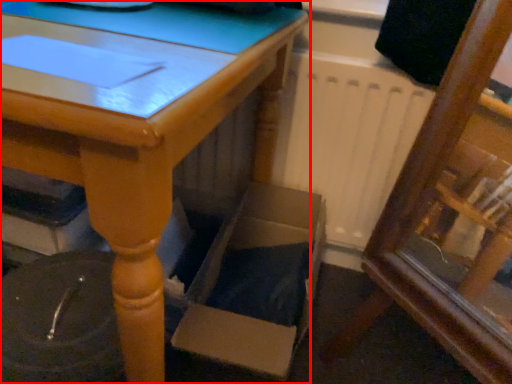
Question: Observing the image, what is the correct spatial positioning of table (annotated by the red box) in reference to cardboard box?

Choices:
 (A) right
 (B) left

Answer: (B)